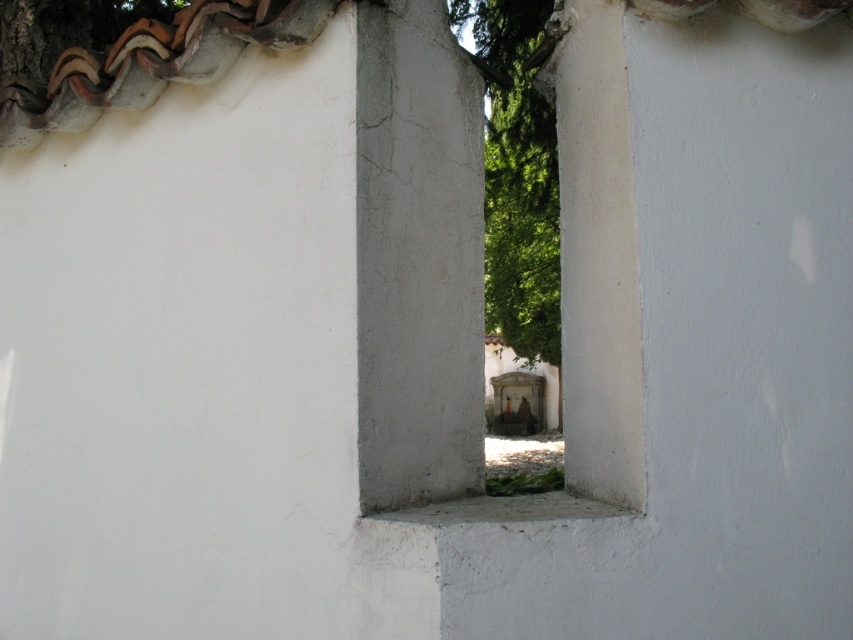
Question: Which object is closer to the camera taking this photo?

Choices:
 (A) green leafy tree at center
 (B) white rough concrete window at center
 (C) white concrete pillar at center

Answer: (B)

Question: Considering the relative positions of white rough concrete window at center and white rough concrete at center in the image provided, where is white rough concrete window at center located with respect to white rough concrete at center?

Choices:
 (A) right
 (B) left

Answer: (B)

Question: Which point is farther to the camera?

Choices:
 (A) (397, 35)
 (B) (469, 8)
 (C) (471, 516)

Answer: (B)

Question: Does white concrete pillar at center appear on the left side of white rough concrete at center?

Choices:
 (A) yes
 (B) no

Answer: (A)

Question: Which point appears closest to the camera in this image?

Choices:
 (A) (590, 360)
 (B) (380, 216)
 (C) (532, 90)
 (D) (445, 520)

Answer: (D)

Question: In this image, where is white rough concrete window at center located relative to white concrete pillar at center?

Choices:
 (A) right
 (B) left

Answer: (A)